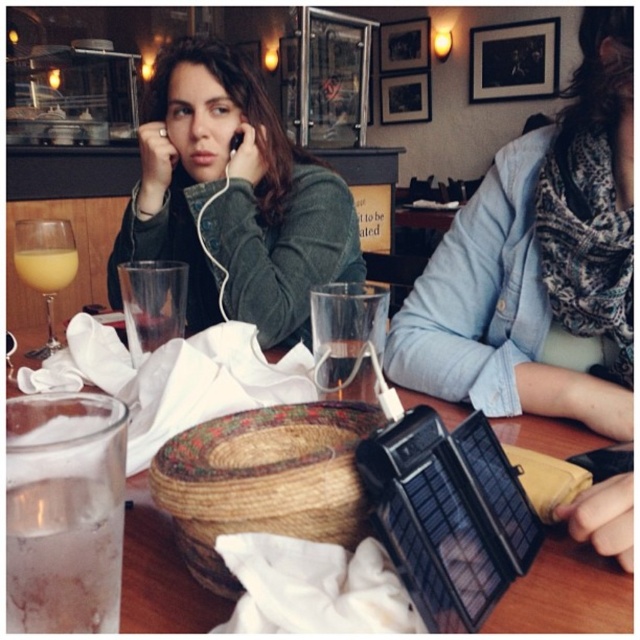
You are sitting at the table in the image and want to place an object between the two points labeled as point (195,273) and point (243,132). Which point should you place it closer to in order to ensure it is closer to the viewer?

You should place the object closer to point (195,273) because it is further to the viewer than point (243,132).

You are a customer at this cozy indoor setting and want to place your phone on the wooden table at center. However, you notice the black matte earphone at upper center is in the way. Can you move the earphone to the left to make space?

The wooden table at center is to the right of the black matte earphone at upper center. Moving the earphone to the left would free up space on the table to place your phone.

You are a waiter in a busy cafe and need to deliver a dessert to the table. The dessert needs to be placed between the translucent glass at center and the yellow liquid at upper left. Can you fit it there?

The translucent glass at center is to the right of yellow liquid at upper left, so there is space between them to place the dessert.